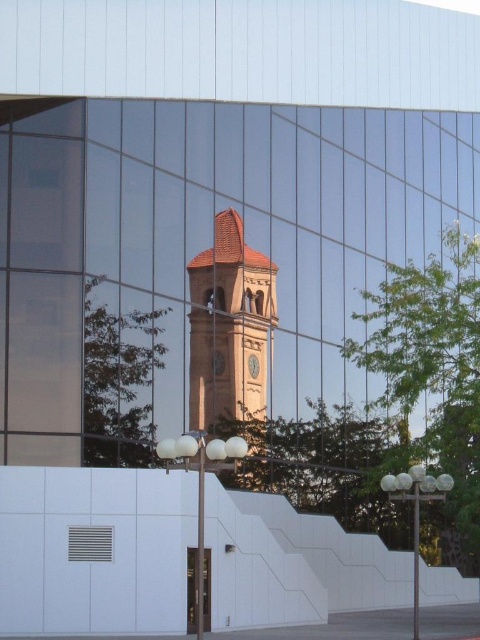
You are standing in front of the transparent glass door at lower center and want to reach the metallic grid at lower left. Which direction should you move to get there?

You should move to the left to reach the metallic grid at lower left since it is positioned to the left of the transparent glass door at lower center.

You are standing at a point 41.70 meters away from the point labeled as point (254, 330) in the image. Based on the scene, what might you be observing from your current position?

You are observing the modern architectural structure with a reflective glass facade that captures the reflection of the traditional clock tower and surrounding greenery, as you are 41.70 meters away from the point labeled point (254, 330).

You are standing at the bottom of the steps leading to the white wall and want to walk towards the point labeled as point (x=88, y=547). Which direction should you walk to reach the point labeled as point (x=239, y=285) after passing the first point?

To reach point (x=239, y=285) after passing point (x=88, y=547), you should walk towards the direction where point (x=239, y=285) is located behind point (x=88, y=547). Since point (x=239, y=285) is behind point (x=88, y=547), you should continue moving forward past point (x=88, y=547) until you reach point (x=239, y=285).